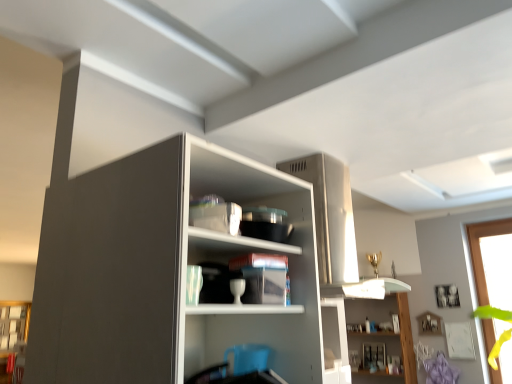
Question: Does transparent glass window at right contain matte cardboard box at center, which is the first shelf from top to bottom?

Choices:
 (A) no
 (B) yes

Answer: (A)

Question: Considering the relative sizes of transparent glass window at right and matte cardboard box at center, the 2th shelf positioned from the back, in the image provided, is transparent glass window at right thinner than matte cardboard box at center, the 2th shelf positioned from the back,?

Choices:
 (A) no
 (B) yes

Answer: (A)

Question: Is transparent glass window at right further to camera compared to matte cardboard box at center, marked as the 1th shelf in a left-to-right arrangement?

Choices:
 (A) no
 (B) yes

Answer: (B)

Question: Considering the relative sizes of transparent glass window at right and matte cardboard box at center, marked as the 1th shelf in a left-to-right arrangement, in the image provided, is transparent glass window at right smaller than matte cardboard box at center, marked as the 1th shelf in a left-to-right arrangement,?

Choices:
 (A) yes
 (B) no

Answer: (B)

Question: Considering the relative sizes of transparent glass window at right and matte cardboard box at center, the 2th shelf positioned from the back, in the image provided, is transparent glass window at right taller than matte cardboard box at center, the 2th shelf positioned from the back,?

Choices:
 (A) yes
 (B) no

Answer: (A)

Question: Is matte cardboard box at center, which ranks as the 1th shelf in front-to-back order, taller or shorter than white glossy shelf at upper center, acting as the second shelf starting from the front?

Choices:
 (A) tall
 (B) short

Answer: (B)

Question: Is matte cardboard box at center, the 2th shelf positioned from the back, bigger or smaller than white glossy shelf at upper center, arranged as the second shelf when viewed from the top?

Choices:
 (A) big
 (B) small

Answer: (B)

Question: Considering their positions, is matte cardboard box at center, which is the first shelf from top to bottom, located in front of or behind white glossy shelf at upper center, acting as the second shelf starting from the front?

Choices:
 (A) front
 (B) behind

Answer: (A)

Question: Based on their positions, is matte cardboard box at center, the 2th shelf positioned from the back, located to the left or right of white glossy shelf at upper center, acting as the second shelf starting from the front?

Choices:
 (A) left
 (B) right

Answer: (A)

Question: Would you say white glossy shelf at upper center, the 2th shelf from the left, is to the left or to the right of matte cardboard box at center, the 2th shelf positioned from the back, in the picture?

Choices:
 (A) right
 (B) left

Answer: (A)

Question: Is point (372, 312) closer or farther from the camera than point (195, 314)?

Choices:
 (A) farther
 (B) closer

Answer: (A)

Question: From the image's perspective, relative to matte cardboard box at center, which ranks as the 1th shelf in front-to-back order, is white glossy shelf at upper center, acting as the second shelf starting from the front, above or below?

Choices:
 (A) above
 (B) below

Answer: (B)

Question: Is white glossy shelf at upper center, which ranks as the 1th shelf in right-to-left order, in front of or behind matte cardboard box at center, the 2th shelf positioned from the bottom, in the image?

Choices:
 (A) behind
 (B) front

Answer: (A)

Question: Looking at the image, does transparent glass window at right seem bigger or smaller compared to white glossy shelf at upper center, the 1th shelf ordered from the bottom?

Choices:
 (A) big
 (B) small

Answer: (A)

Question: From the image's perspective, is transparent glass window at right positioned above or below white glossy shelf at upper center, acting as the second shelf starting from the front?

Choices:
 (A) below
 (B) above

Answer: (B)